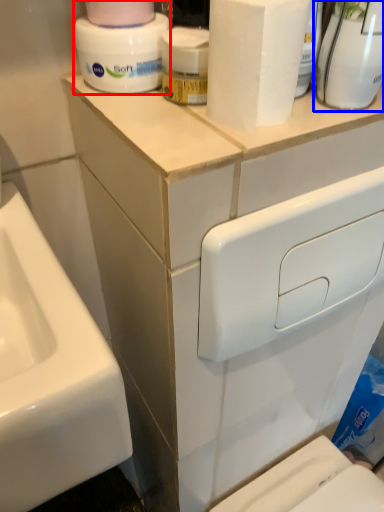
Question: Which object is closer to the camera taking this photo, cleaning product (highlighted by a red box) or cleaning product (highlighted by a blue box)?

Choices:
 (A) cleaning product
 (B) cleaning product

Answer: (B)